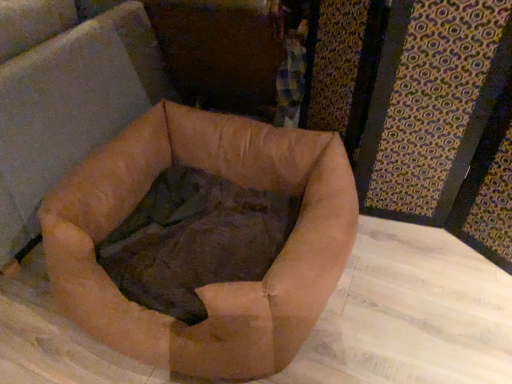
Measure the distance between point (42, 167) and camera.

Point (42, 167) is 4.97 feet from camera.

What do you see at coordinates (70, 108) in the screenshot? The image size is (512, 384). I see `brown suede swivel chair at center` at bounding box center [70, 108].

In order to face brown suede swivel chair at center, should I rotate leftwards or rightwards?

To face it directly, rotate left by 25.974 degrees.

Identify the location of brown suede swivel chair at center. click(70, 108).

At what (x,y) coordinates should I click in order to perform the action: click on brown suede swivel chair at center. Please return your answer as a coordinate pair (x, y). This screenshot has height=384, width=512. Looking at the image, I should click on (70, 108).